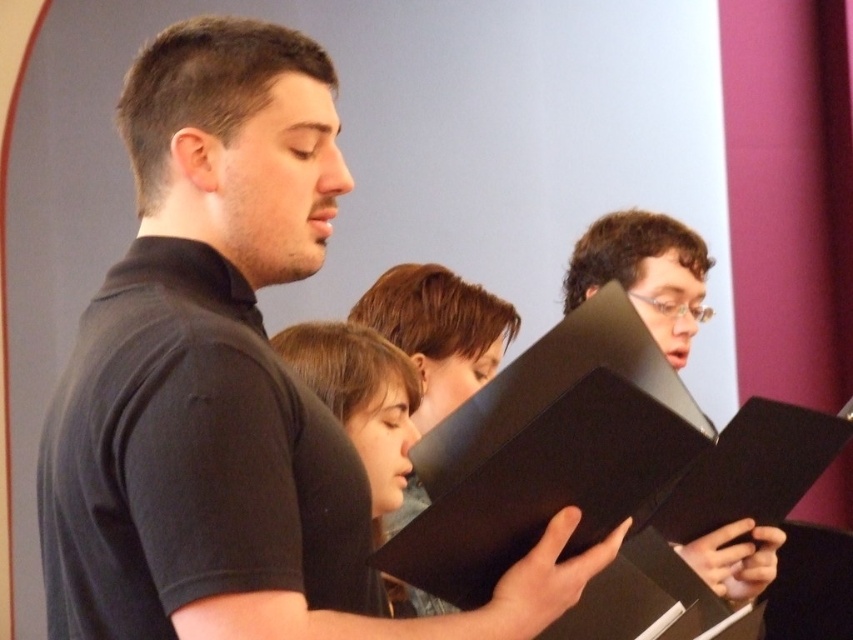
You are a stagehand preparing to place two black matte books on a shelf. The shelf has a width of 20 cm. The first book, the black matte book at center, is larger than the matte black book at center. Can both books fit side by side on the shelf?

The black matte book at center is bigger than the matte black book at center, so it is uncertain if both can fit side by side on the 20 cm shelf without overlapping. Measure their combined width to confirm.